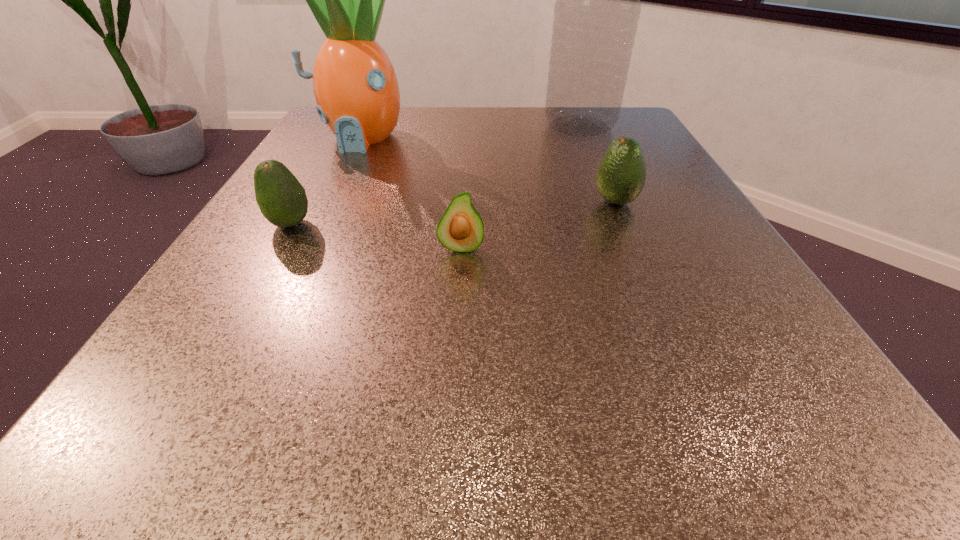
At what (x,y) coordinates should I click in order to perform the action: click on free space between the rightmost avocado and the fourth shortest object. Please return your answer as a coordinate pair (x, y). Looking at the image, I should click on (488, 170).

You are a GUI agent. You are given a task and a screenshot of the screen. Output one action in this format:
    pyautogui.click(x=<x>, y=<y>)
    Task: Click on the vacant area that lies between the water jug and the second avocado from right to left
    This screenshot has width=960, height=540.
    Given the screenshot: What is the action you would take?
    pyautogui.click(x=520, y=187)

What are the coordinates of `free area in between the rightmost avocado and the third object from left to right` in the screenshot? It's located at (539, 225).

Image resolution: width=960 pixels, height=540 pixels. Find the location of `empty space between the second tallest object and the water jug`. empty space between the second tallest object and the water jug is located at coordinates (469, 132).

Locate an element on the screen. Image resolution: width=960 pixels, height=540 pixels. the second closest object to the leftmost avocado is located at coordinates (460, 229).

Locate which object is the closest to the leftmost avocado. Please provide its 2D coordinates. Your answer should be formatted as a tuple, i.e. [(x, y)], where the tuple contains the x and y coordinates of a point satisfying the conditions above.

[(356, 89)]

You are a GUI agent. You are given a task and a screenshot of the screen. Output one action in this format:
    pyautogui.click(x=<x>, y=<y>)
    Task: Click on the closest avocado relative to the leftmost avocado
    This screenshot has width=960, height=540.
    Given the screenshot: What is the action you would take?
    pyautogui.click(x=460, y=229)

Find the location of `avocado that can be found as the second closest to the rightmost avocado`. avocado that can be found as the second closest to the rightmost avocado is located at coordinates (282, 200).

You are a GUI agent. You are given a task and a screenshot of the screen. Output one action in this format:
    pyautogui.click(x=<x>, y=<y>)
    Task: Click on the vacant area in the image that satisfies the following two spatial constraints: 1. on the back side of the water jug; 2. on the left side of the leftmost avocado
    This screenshot has width=960, height=540.
    Given the screenshot: What is the action you would take?
    pyautogui.click(x=347, y=126)

This screenshot has height=540, width=960. Identify the location of vacant space that satisfies the following two spatial constraints: 1. on the front side of the rightmost avocado; 2. on the left side of the water jug. (612, 202).